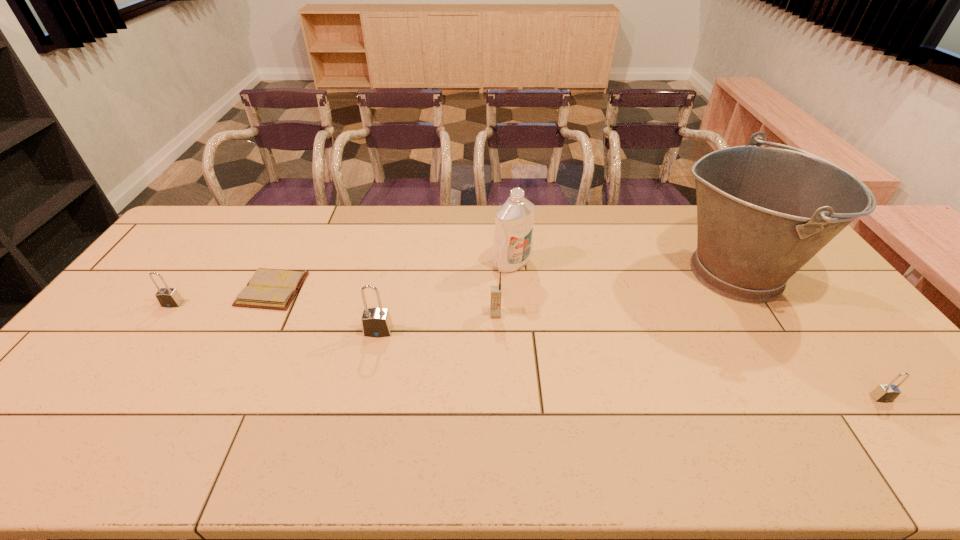
Find the location of a particular element. The width and height of the screenshot is (960, 540). cellular telephone is located at coordinates (496, 291).

The height and width of the screenshot is (540, 960). Find the location of `free region located on the shackle of the farthest padlock`. free region located on the shackle of the farthest padlock is located at coordinates (126, 369).

Find the location of a particular element. The height and width of the screenshot is (540, 960). free space located on the shackle of the tallest padlock is located at coordinates (362, 404).

At what (x,y) coordinates should I click in order to perform the action: click on vacant position located on the left of the bucket. Please return your answer as a coordinate pair (x, y). Looking at the image, I should click on (650, 273).

Image resolution: width=960 pixels, height=540 pixels. I want to click on blank space located on the left of the shortest object, so click(x=152, y=289).

The image size is (960, 540). What are the coordinates of `vacant region located 0.290m on the right of the sixth shortest object` in the screenshot? It's located at (619, 264).

The image size is (960, 540). What are the coordinates of `vacant region located on the front of the cellular telephone, where the keypad is located` in the screenshot? It's located at 499,415.

Locate an element on the screen. This screenshot has width=960, height=540. object that is at the far edge is located at coordinates (763, 212).

What are the coordinates of `object positioned at the near edge` in the screenshot? It's located at (884, 393).

The image size is (960, 540). In order to click on object that is at the left edge in this screenshot , I will do `click(167, 297)`.